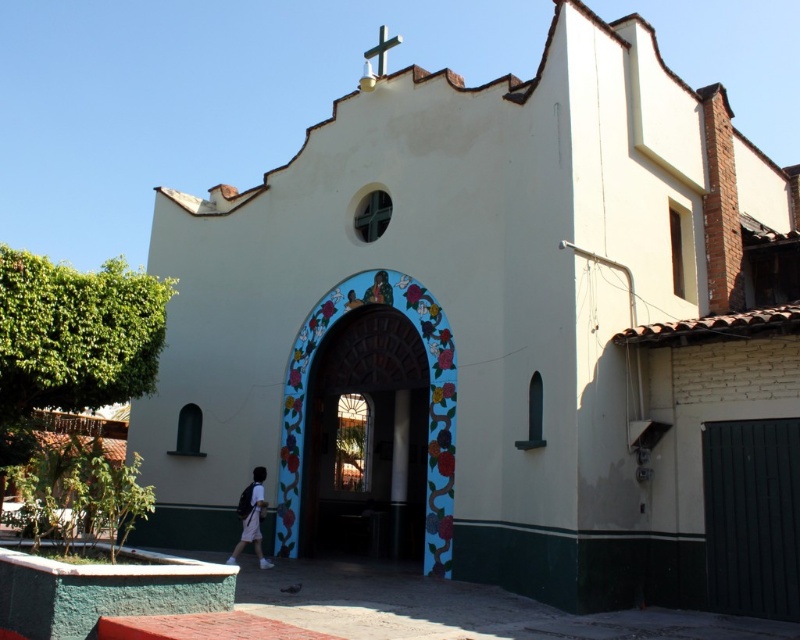
You are standing in front of the church and looking at the two points marked on the image. Which point, point [354,346] or point [393,38], is closer to you?

Point [354,346] is closer to you than point [393,38].

You are standing in front of the church and want to place your white fabric backpack at center under the painted brick archway at center. Is this possible?

The painted brick archway at center is located above the white fabric backpack at center, so yes, the backpack can be placed under the archway.

You are standing at the entrance of the church and want to place a 1.5 meter wide decorative panel between the painted brick archway at center and the entrance. Is there enough space?

The distance between the entrance and the painted brick archway at center is 39.69 meters, which is more than enough space to place a 1.5 meter wide decorative panel between them.